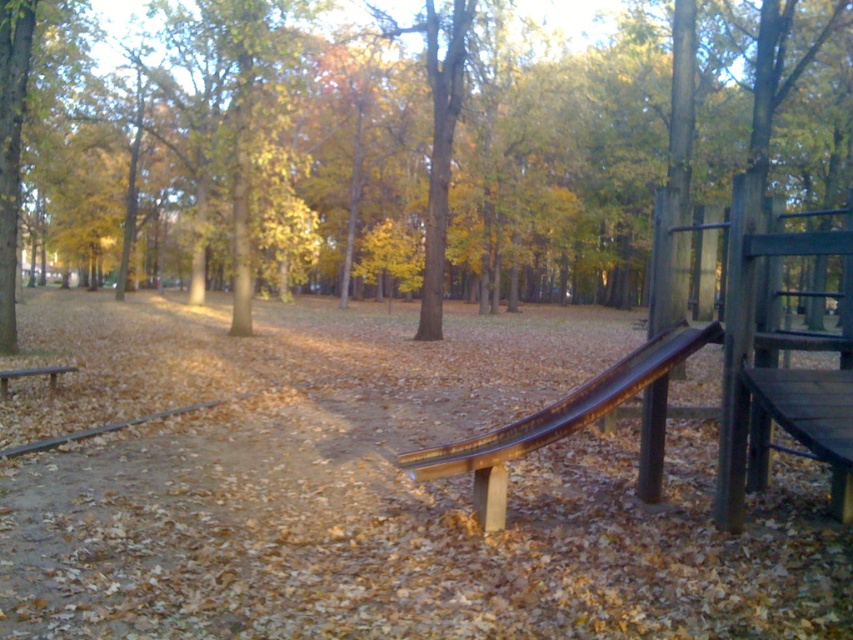
Based on the photo, who is positioned more to the right, wooden bench at center or wooden bench at left?

Positioned to the right is wooden bench at center.

Which is below, wooden bench at center or wooden bench at left?

wooden bench at center is lower down.

You are a GUI agent. You are given a task and a screenshot of the screen. Output one action in this format:
    pyautogui.click(x=<x>, y=<y>)
    Task: Click on the wooden bench at center
    This screenshot has height=640, width=853.
    Given the screenshot: What is the action you would take?
    pyautogui.click(x=553, y=420)

The image size is (853, 640). Find the location of `wooden bench at center`. wooden bench at center is located at coordinates coord(553,420).